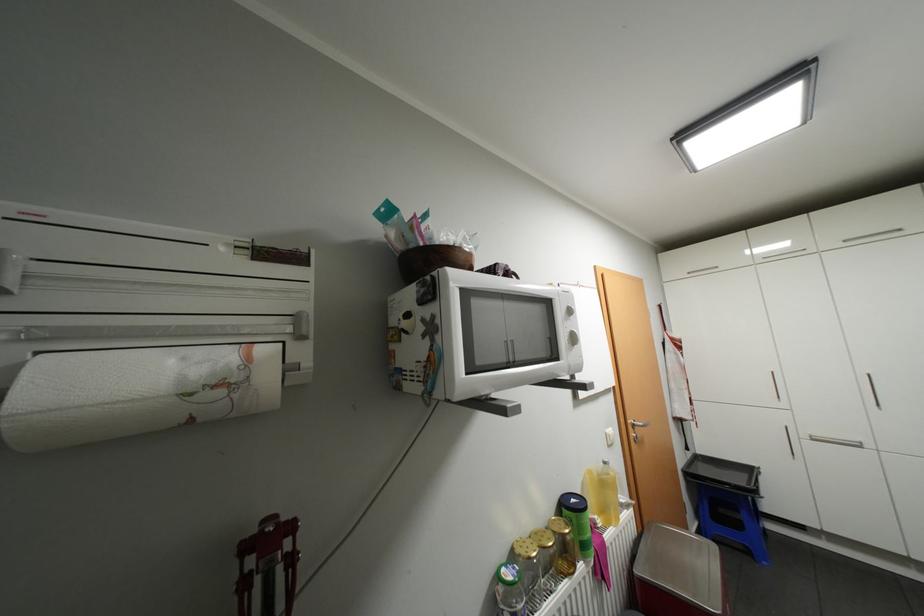
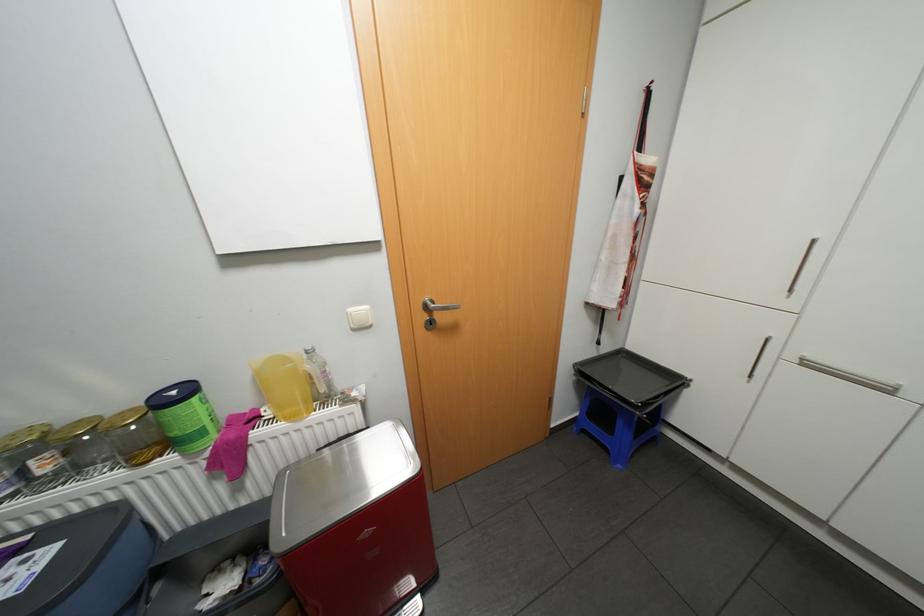
Locate, in the second image, the point that corresponds to (x=606, y=521) in the first image.

(275, 413)